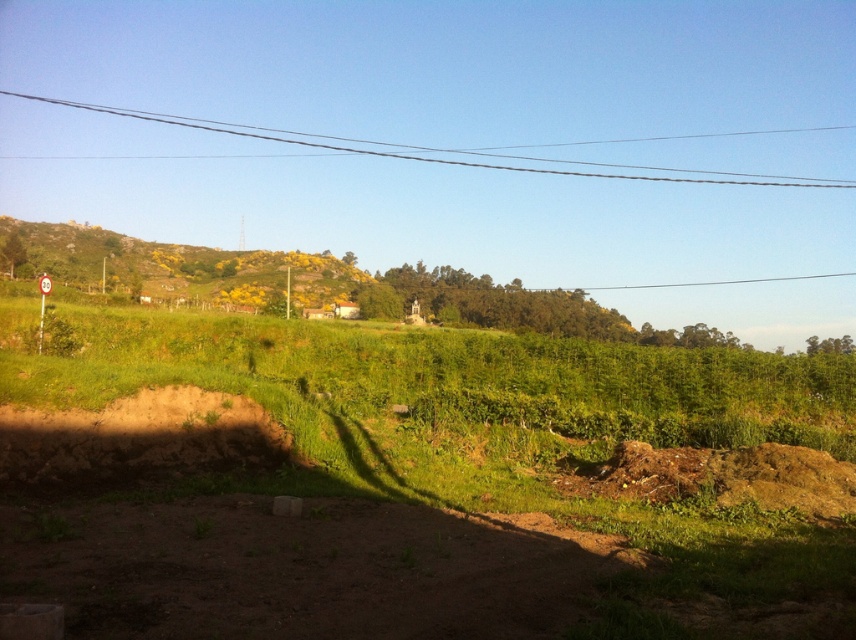
Is green grassy hillside at upper left positioned at the back of clear wire at upper center?

No, green grassy hillside at upper left is closer to the viewer.

Between green grassy hillside at upper left and clear wire at upper center, which one has less height?

With less height is green grassy hillside at upper left.

Describe the element at coordinates (170, 268) in the screenshot. The width and height of the screenshot is (856, 640). I see `green grassy hillside at upper left` at that location.

Where is `green grassy hillside at upper left`? green grassy hillside at upper left is located at coordinates (170, 268).

From the picture: Between green grassy at center and brown dirt track at lower center, which one appears on the left side from the viewer's perspective?

green grassy at center is more to the left.

Between point (411, 394) and point (146, 554), which one is positioned in front?

Point (146, 554)

You are a GUI agent. You are given a task and a screenshot of the screen. Output one action in this format:
    pyautogui.click(x=<x>, y=<y>)
    Task: Click on the green grassy at center
    This screenshot has width=856, height=640.
    Given the screenshot: What is the action you would take?
    pyautogui.click(x=461, y=396)

Is green grassy at center bigger than clear wire at upper center?

Actually, green grassy at center might be smaller than clear wire at upper center.

In the scene shown: Is green grassy at center below clear wire at upper center?

Indeed, green grassy at center is positioned under clear wire at upper center.

What do you see at coordinates (461, 396) in the screenshot?
I see `green grassy at center` at bounding box center [461, 396].

You are a GUI agent. You are given a task and a screenshot of the screen. Output one action in this format:
    pyautogui.click(x=<x>, y=<y>)
    Task: Click on the green grassy at center
    The image size is (856, 640).
    Given the screenshot: What is the action you would take?
    pyautogui.click(x=461, y=396)